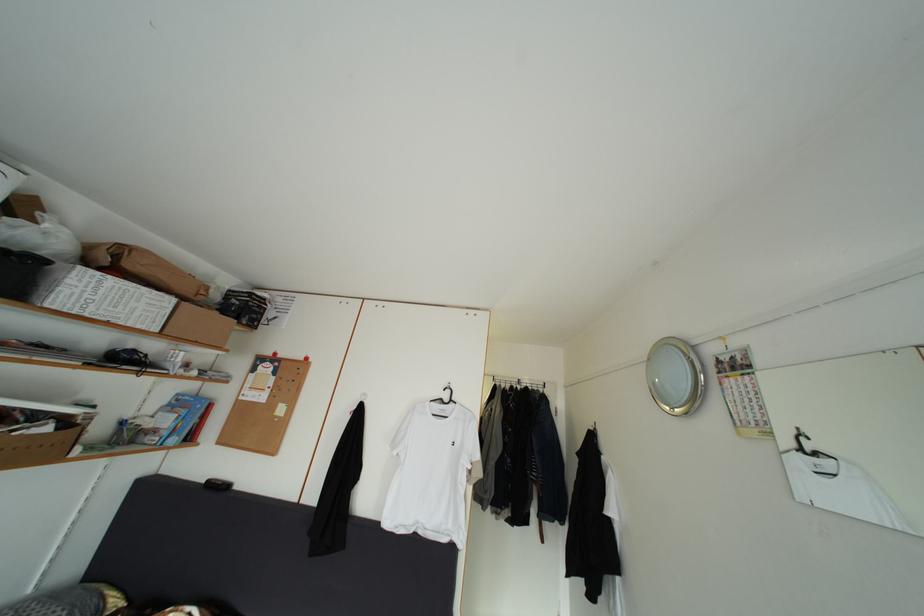
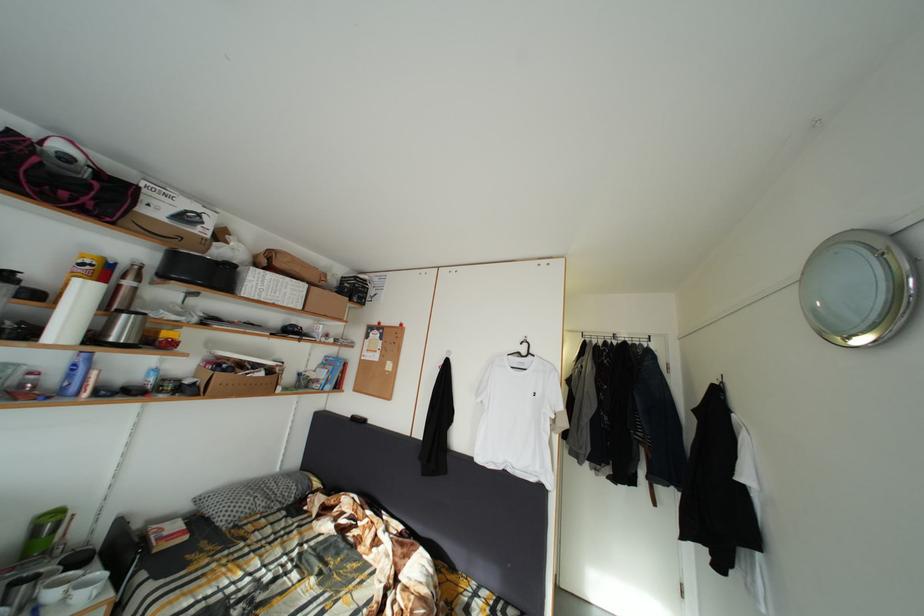
Find the pixel in the second image that matches the point at 46,423 in the first image.

(264, 373)